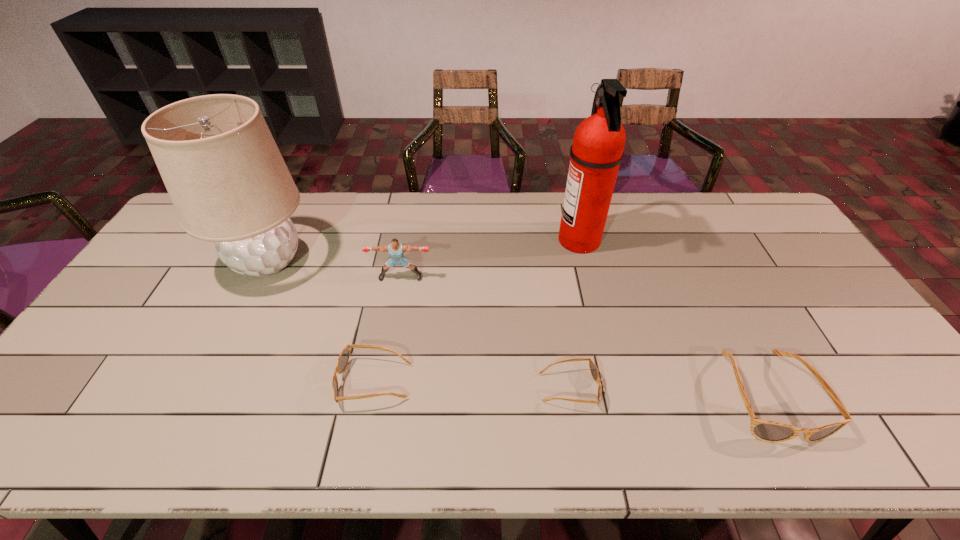
Where is `the second shortest object`? This screenshot has width=960, height=540. the second shortest object is located at coordinates pos(343,359).

This screenshot has height=540, width=960. What are the coordinates of `the leftmost sunglasses` in the screenshot? It's located at (343, 359).

Find the location of a particular element. The width and height of the screenshot is (960, 540). the shortest sunglasses is located at coordinates (593, 368).

Identify the location of the shortest object. The height and width of the screenshot is (540, 960). (593, 368).

Locate an element on the screen. Image resolution: width=960 pixels, height=540 pixels. the fourth tallest object is located at coordinates (768, 431).

At what (x,y) coordinates should I click in order to perform the action: click on the rightmost sunglasses. Please return your answer as a coordinate pair (x, y). Image resolution: width=960 pixels, height=540 pixels. Looking at the image, I should click on (768, 431).

Find the location of a particular element. the fourth shortest object is located at coordinates (396, 250).

Locate an element on the screen. This screenshot has width=960, height=540. fire extinguisher is located at coordinates (596, 153).

The width and height of the screenshot is (960, 540). I want to click on the leftmost object, so click(x=228, y=182).

The width and height of the screenshot is (960, 540). In order to click on vacant space located on the front-facing side of the fifth tallest object in this screenshot , I will do `click(205, 382)`.